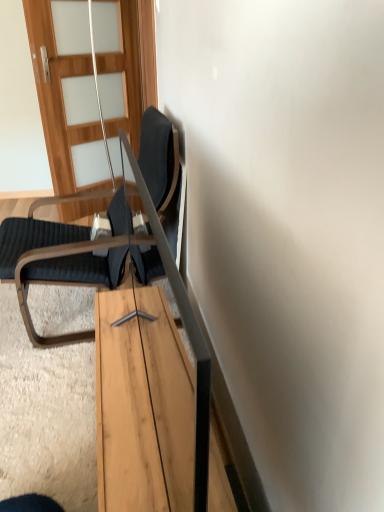
Question: Looking at their shapes, would you say wooden with frosted glass at upper left is wider or thinner than light wood table at center?

Choices:
 (A) thin
 (B) wide

Answer: (B)

Question: Relative to light wood table at center, is wooden with frosted glass at upper left in front or behind?

Choices:
 (A) front
 (B) behind

Answer: (B)

Question: Estimate the real-world distances between objects in this image. Which object is closer to the dark gray fabric chair at left?

Choices:
 (A) wooden with frosted glass at upper left
 (B) light wood table at center

Answer: (B)

Question: Which is nearer to the dark gray fabric chair at left?

Choices:
 (A) light wood table at center
 (B) wooden with frosted glass at upper left

Answer: (A)